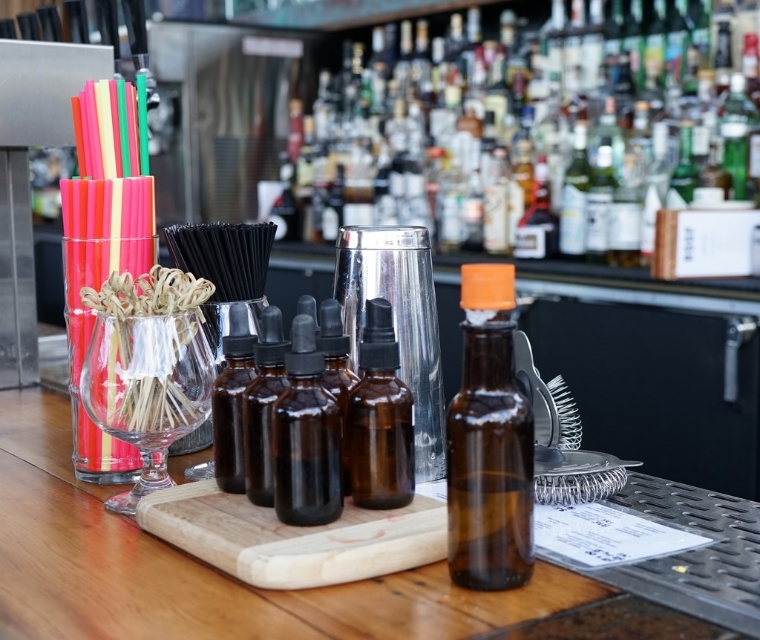
Does brown glass dropper bottle at center have a greater width compared to brown glass bottles at center?

Incorrect, brown glass dropper bottle at center's width does not surpass brown glass bottles at center's.

Does brown glass dropper bottle at center appear over brown glass bottles at center?

Actually, brown glass dropper bottle at center is below brown glass bottles at center.

Is point (312, 397) positioned after point (242, 480)?

No.

Locate an element on the screen. This screenshot has width=760, height=640. brown glass dropper bottle at center is located at coordinates (x=306, y=436).

The height and width of the screenshot is (640, 760). I want to click on shiny silver cocktail shaker at center, so click(x=546, y=124).

Does shiny silver cocktail shaker at center have a lesser height compared to amber glass dropper bottle at center?

No.

Is point (496, 102) farther from camera compared to point (356, 468)?

Yes, it is.

Identify the location of shiny silver cocktail shaker at center. This screenshot has width=760, height=640. (546, 124).

Describe the element at coordinates (293, 538) in the screenshot. I see `wooden cutting board at center` at that location.

Can you confirm if wooden cutting board at center is bigger than brown glass dropper bottles at center?

Correct, wooden cutting board at center is larger in size than brown glass dropper bottles at center.

This screenshot has width=760, height=640. What are the coordinates of `wooden cutting board at center` in the screenshot? It's located at click(293, 538).